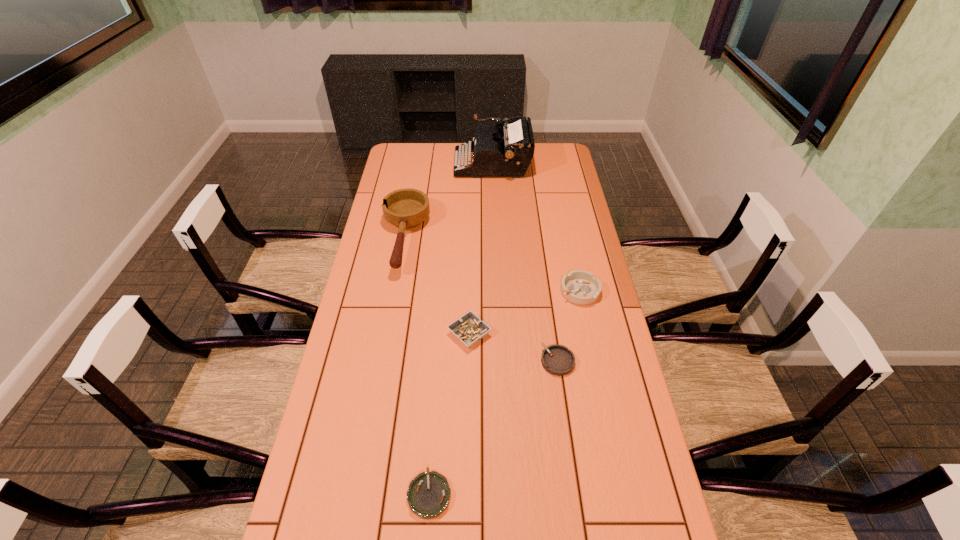
Identify the location of vacant area in the image that satisfies the following two spatial constraints: 1. with the handle on the side of the leftmost object; 2. on the right side of the third tallest object. (395, 291).